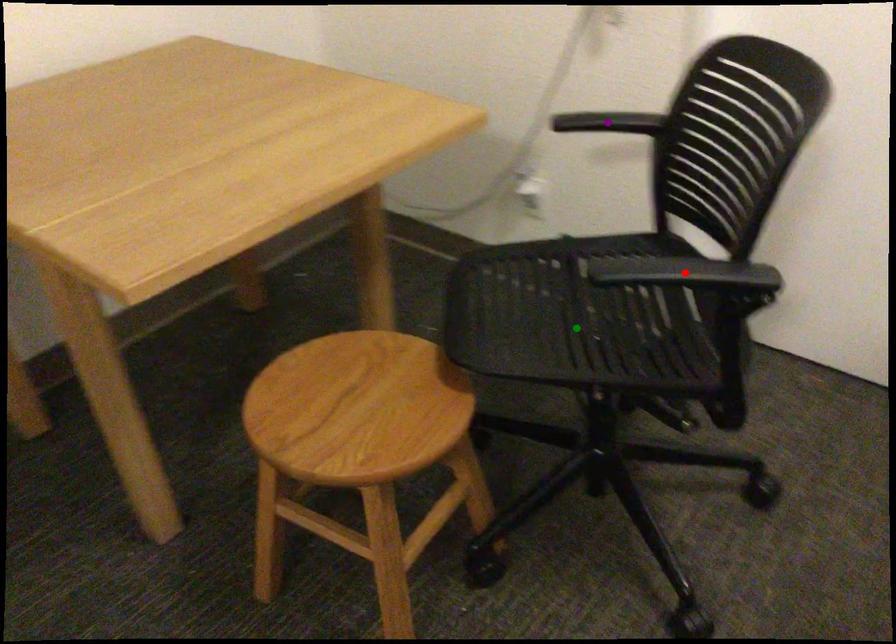
Order these from farthest to nearest:
A) red point
B) green point
C) purple point

green point, purple point, red point